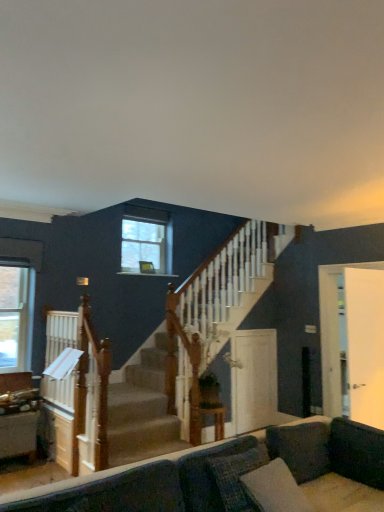
Question: Does white glossy door at center, which is counted as the 1th screen door, starting from the left, have a larger size compared to velvet dark gray couch at lower center?

Choices:
 (A) yes
 (B) no

Answer: (B)

Question: Considering the relative sizes of white glossy door at center, the 2th screen door viewed from the front, and velvet dark gray couch at lower center in the image provided, is white glossy door at center, the 2th screen door viewed from the front, shorter than velvet dark gray couch at lower center?

Choices:
 (A) no
 (B) yes

Answer: (A)

Question: Considering the relative sizes of white glossy door at center, the 2th screen door viewed from the front, and velvet dark gray couch at lower center in the image provided, is white glossy door at center, the 2th screen door viewed from the front, wider than velvet dark gray couch at lower center?

Choices:
 (A) yes
 (B) no

Answer: (B)

Question: Is white glossy door at center, which is counted as the 1th screen door, starting from the left, further to camera compared to velvet dark gray couch at lower center?

Choices:
 (A) no
 (B) yes

Answer: (B)

Question: Can you confirm if white glossy door at center, the 1th screen door positioned from the back, is thinner than velvet dark gray couch at lower center?

Choices:
 (A) no
 (B) yes

Answer: (B)

Question: Considering the positions of clear glass window at left, which is the 1th window in left-to-right order, and velvet dark gray couch at lower center in the image, is clear glass window at left, which is the 1th window in left-to-right order, bigger or smaller than velvet dark gray couch at lower center?

Choices:
 (A) big
 (B) small

Answer: (B)

Question: From the image's perspective, is clear glass window at left, which is the first window in front-to-back order, positioned above or below velvet dark gray couch at lower center?

Choices:
 (A) above
 (B) below

Answer: (A)

Question: In the image, is clear glass window at left, the 2th window positioned from the right, positioned in front of or behind velvet dark gray couch at lower center?

Choices:
 (A) behind
 (B) front

Answer: (A)

Question: Is point (13, 323) closer or farther from the camera than point (147, 488)?

Choices:
 (A) closer
 (B) farther

Answer: (B)

Question: Do you think clear glass window at upper center, which appears as the 1th window when viewed from the right, is within white glossy door at right, arranged as the first screen door when viewed from the right, or outside of it?

Choices:
 (A) inside
 (B) outside

Answer: (B)

Question: From a real-world perspective, is clear glass window at upper center, positioned as the 1th window in top-to-bottom order, positioned above or below white glossy door at right, arranged as the first screen door when viewed from the right?

Choices:
 (A) above
 (B) below

Answer: (A)

Question: From the image's perspective, is clear glass window at upper center, marked as the first window in a back-to-front arrangement, above or below white glossy door at right, acting as the first screen door starting from the front?

Choices:
 (A) above
 (B) below

Answer: (A)

Question: From their relative heights in the image, would you say clear glass window at upper center, marked as the 2th window in a bottom-to-top arrangement, is taller or shorter than white glossy door at right, which is the 2th screen door from back to front?

Choices:
 (A) tall
 (B) short

Answer: (B)

Question: From their relative heights in the image, would you say white glossy door at right, which is the 2th screen door from back to front, is taller or shorter than wooden table at center?

Choices:
 (A) tall
 (B) short

Answer: (A)

Question: Considering the positions of white glossy door at right, marked as the second screen door in a left-to-right arrangement, and wooden table at center in the image, is white glossy door at right, marked as the second screen door in a left-to-right arrangement, wider or thinner than wooden table at center?

Choices:
 (A) thin
 (B) wide

Answer: (A)